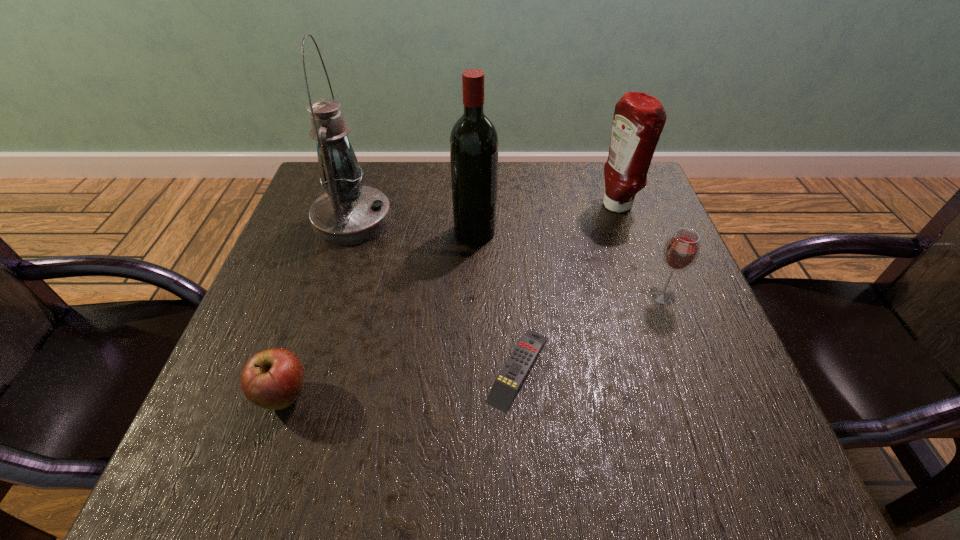
Locate an element on the screen. The height and width of the screenshot is (540, 960). object positioned at the far right corner is located at coordinates (639, 118).

Where is `free region at the far edge of the desktop`? free region at the far edge of the desktop is located at coordinates (534, 173).

Where is `free space at the near edge`? Image resolution: width=960 pixels, height=540 pixels. free space at the near edge is located at coordinates pyautogui.click(x=565, y=454).

At what (x,y) coordinates should I click in order to perform the action: click on free spot at the left edge of the desktop. Please return your answer as a coordinate pair (x, y). Looking at the image, I should click on (300, 220).

I want to click on free region at the right edge of the desktop, so click(x=701, y=333).

Locate an element on the screen. This screenshot has height=540, width=960. vacant point located between the shortest object and the third tallest object is located at coordinates (567, 287).

Find the location of a particular element. vacant point located between the apple and the oil lamp is located at coordinates (319, 308).

At what (x,y) coordinates should I click in order to perform the action: click on free space between the fourth shortest object and the wine bottle. Please return your answer as a coordinate pair (x, y). The height and width of the screenshot is (540, 960). Looking at the image, I should click on (545, 219).

Identify the location of vacant region between the fourth shortest object and the third shortest object. (639, 251).

Where is `unoccupied position between the apple and the shortest object`? unoccupied position between the apple and the shortest object is located at coordinates (401, 382).